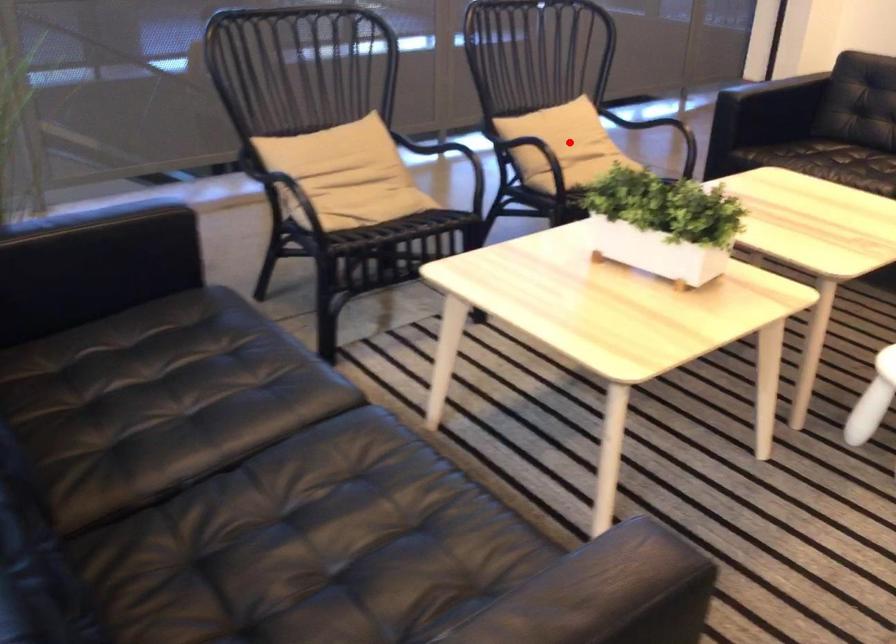
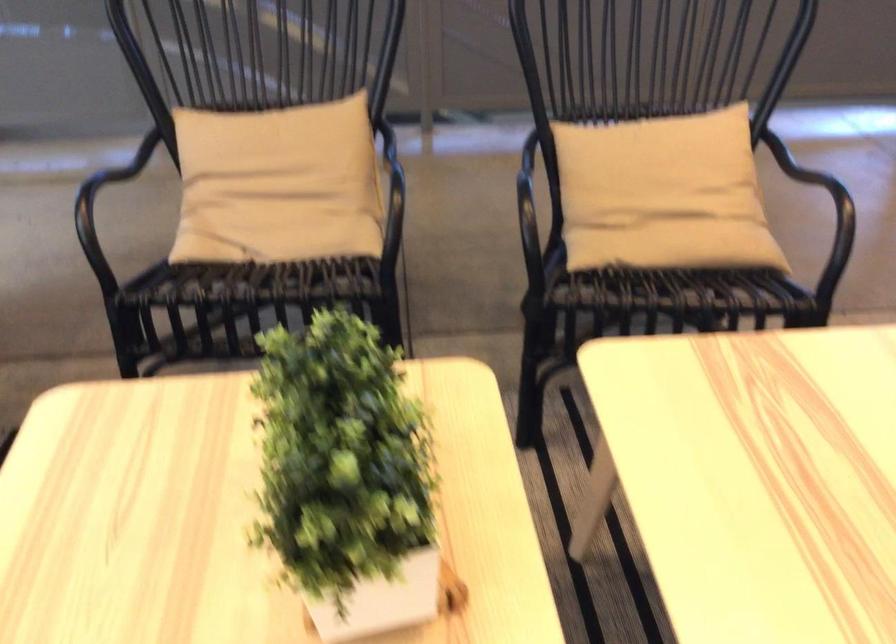
In the second image, find the point that corresponds to the highlighted location in the first image.

(662, 194)